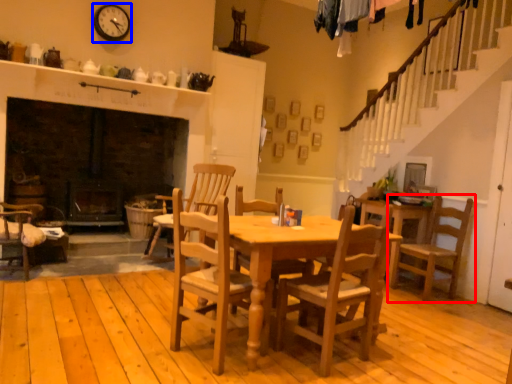
Question: Which point is closer to the camera, chair (highlighted by a red box) or clock (highlighted by a blue box)?

Choices:
 (A) chair
 (B) clock

Answer: (A)